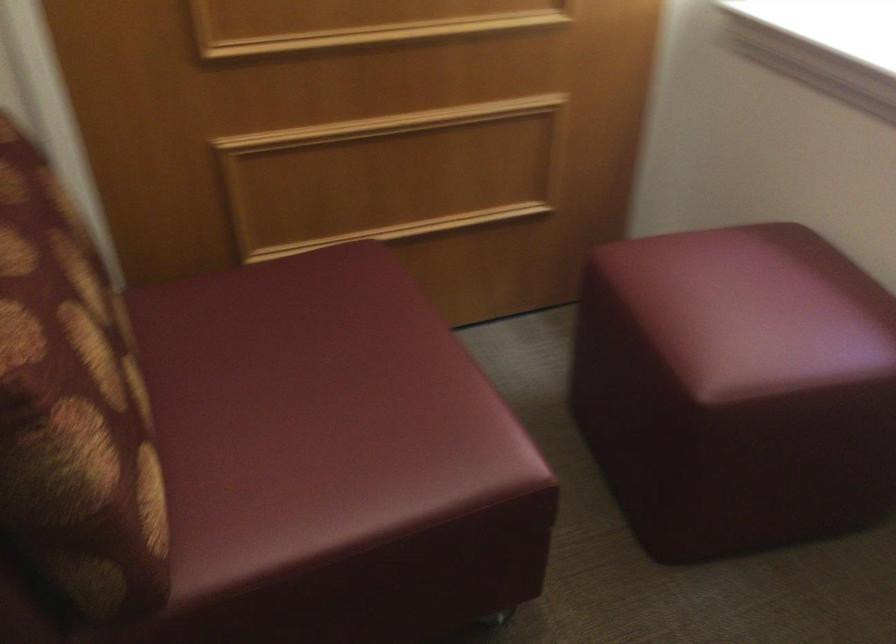
Find where to sit the red ottoman sitting surface. Please return your answer as a coordinate pair (x, y).

(314, 415)